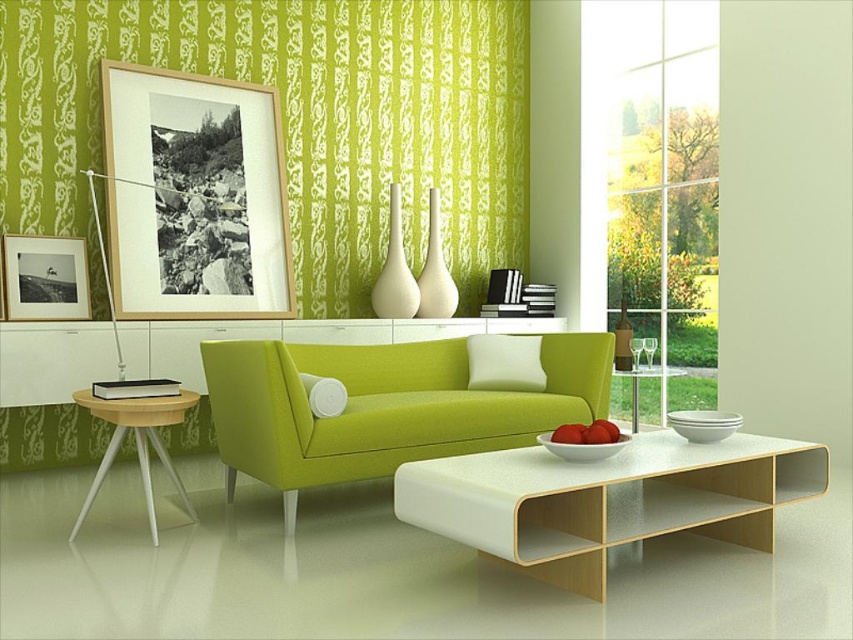
Question: Can you confirm if lime green fabric couch at center is positioned to the right of wooden picture frame at upper left?

Choices:
 (A) yes
 (B) no

Answer: (A)

Question: Which point appears closest to the camera in this image?

Choices:
 (A) (49, 288)
 (B) (756, 504)
 (C) (218, 403)

Answer: (B)

Question: Is white glossy table at center below light brown wood side table at left?

Choices:
 (A) no
 (B) yes

Answer: (B)

Question: Which of the following is the closest to the observer?

Choices:
 (A) (532, 506)
 (B) (426, 417)

Answer: (A)

Question: Can you confirm if green fabric curtain at upper center is positioned to the left of lime green fabric couch at center?

Choices:
 (A) yes
 (B) no

Answer: (A)

Question: Based on their relative distances, which object is farther from the green fabric curtain at upper center?

Choices:
 (A) wooden picture frame at upper left
 (B) light brown wood side table at left
 (C) matte black picture frame at left
 (D) lime green fabric couch at center

Answer: (B)